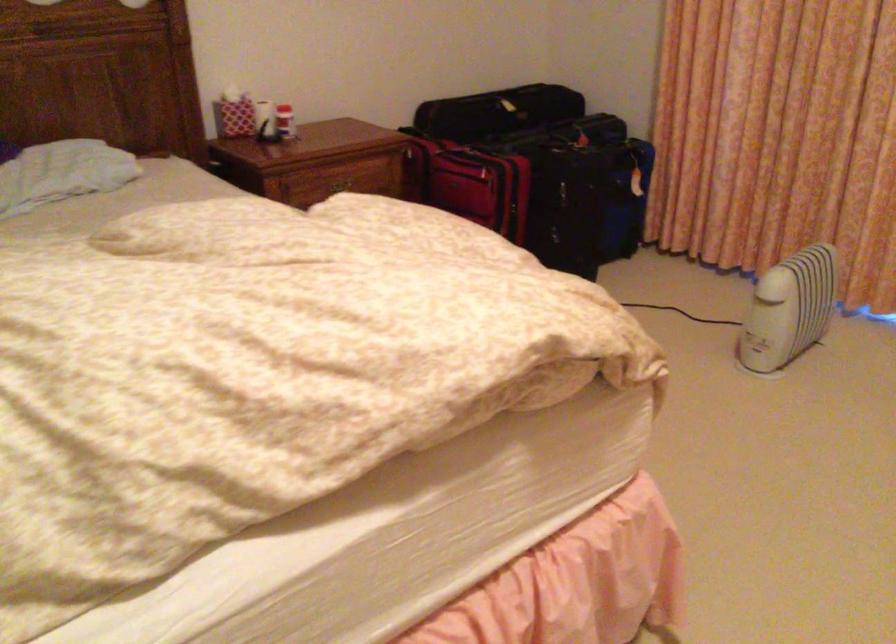
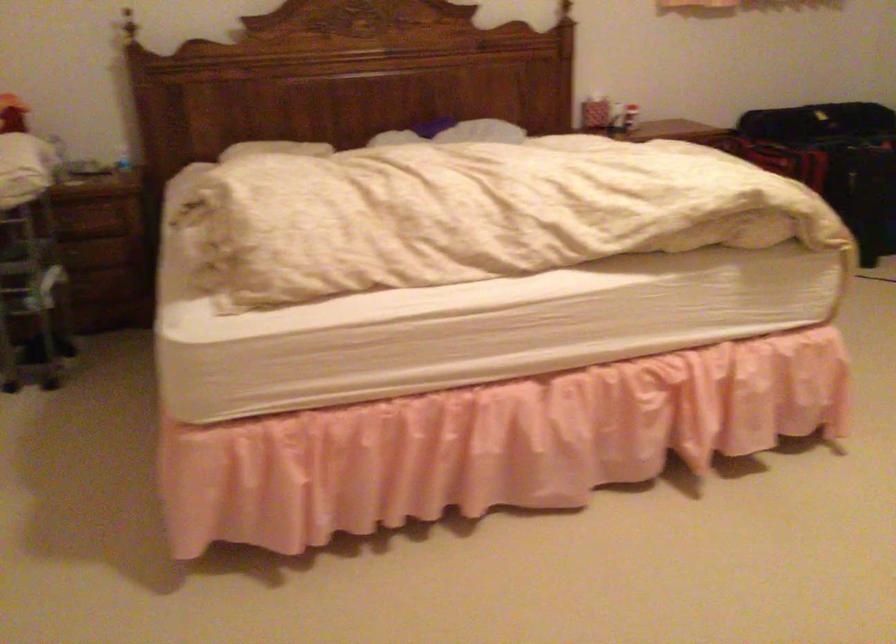
Locate, in the second image, the point that corresponds to the point at 227,145 in the first image.

(590, 109)